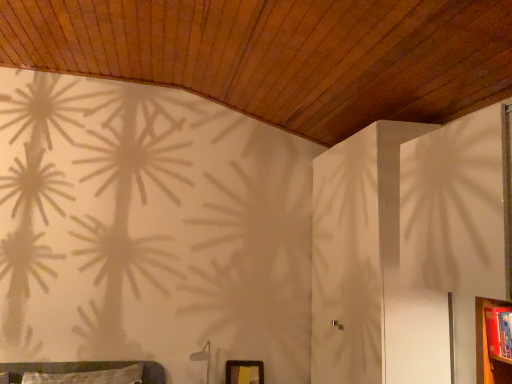
What do you see at coordinates (488, 347) in the screenshot? The width and height of the screenshot is (512, 384). I see `wooden dresser at lower right` at bounding box center [488, 347].

Find the location of `wooden dresser at lower right`. wooden dresser at lower right is located at coordinates (488, 347).

Looking at this image, what is the approximate height of wooden dresser at lower right?

9.23 inches.

Measure the distance between wooden dresser at lower right and camera.

wooden dresser at lower right and camera are 5.94 feet apart.

The height and width of the screenshot is (384, 512). Identify the location of matte black picture frame at lower center. (244, 372).

What do you see at coordinates (244, 372) in the screenshot? I see `matte black picture frame at lower center` at bounding box center [244, 372].

This screenshot has height=384, width=512. Find the location of `wooden dresser at lower right`. wooden dresser at lower right is located at coordinates (488, 347).

Considering the positions of objects wooden dresser at lower right and matte black picture frame at lower center in the image provided, who is more to the right, wooden dresser at lower right or matte black picture frame at lower center?

From the viewer's perspective, wooden dresser at lower right appears more on the right side.

Does wooden dresser at lower right come behind matte black picture frame at lower center?

No, wooden dresser at lower right is in front of matte black picture frame at lower center.

Considering the points (477, 310) and (248, 371), which point is in front, point (477, 310) or point (248, 371)?

Point (477, 310)

From the picture: From the image's perspective, is wooden dresser at lower right located above matte black picture frame at lower center?

Yes, from the image's perspective, wooden dresser at lower right is on top of matte black picture frame at lower center.

From a real-world perspective, which object rests below the other?

matte black picture frame at lower center.

Which of these two, wooden dresser at lower right or matte black picture frame at lower center, is thinner?

Thinner between the two is matte black picture frame at lower center.

Can you confirm if wooden dresser at lower right is taller than matte black picture frame at lower center?

Yes, wooden dresser at lower right is taller than matte black picture frame at lower center.

Consider the image. Does wooden dresser at lower right have a smaller size compared to matte black picture frame at lower center?

Actually, wooden dresser at lower right might be larger than matte black picture frame at lower center.

Would you say matte black picture frame at lower center is part of wooden dresser at lower right's contents?

No, matte black picture frame at lower center is located outside of wooden dresser at lower right.

Is wooden dresser at lower right placed right next to matte black picture frame at lower center?

No, wooden dresser at lower right is not touching matte black picture frame at lower center.

Is wooden dresser at lower right positioned with its back to matte black picture frame at lower center?

No, wooden dresser at lower right's orientation is not away from matte black picture frame at lower center.

Can you tell me how much wooden dresser at lower right and matte black picture frame at lower center differ in facing direction?

The angle between the facing direction of wooden dresser at lower right and the facing direction of matte black picture frame at lower center is 86.6 degrees.

Identify the location of picture frame below the wooden dresser at lower right (from a real-world perspective). This screenshot has height=384, width=512. (244, 372).

Based on the photo, between matte black picture frame at lower center and wooden dresser at lower right, which one appears on the left side from the viewer's perspective?

Positioned to the left is matte black picture frame at lower center.

Which is behind, matte black picture frame at lower center or wooden dresser at lower right?

matte black picture frame at lower center is further from the camera.

Which is farther, (243, 381) or (489, 353)?

The point (243, 381) is farther from the camera.

From the image's perspective, between matte black picture frame at lower center and wooden dresser at lower right, which one is located above?

From the image's view, wooden dresser at lower right is above.

From a real-world perspective, between matte black picture frame at lower center and wooden dresser at lower right, who is vertically higher?

From a 3D spatial view, wooden dresser at lower right is above.

Considering the sizes of objects matte black picture frame at lower center and wooden dresser at lower right in the image provided, who is thinner, matte black picture frame at lower center or wooden dresser at lower right?

With smaller width is matte black picture frame at lower center.

Considering the relative sizes of matte black picture frame at lower center and wooden dresser at lower right in the image provided, is matte black picture frame at lower center taller than wooden dresser at lower right?

No, matte black picture frame at lower center is not taller than wooden dresser at lower right.

Considering the relative sizes of matte black picture frame at lower center and wooden dresser at lower right in the image provided, is matte black picture frame at lower center smaller than wooden dresser at lower right?

Indeed, matte black picture frame at lower center has a smaller size compared to wooden dresser at lower right.

Would you say matte black picture frame at lower center is outside wooden dresser at lower right?

matte black picture frame at lower center is positioned outside wooden dresser at lower right.

Would you say matte black picture frame at lower center is a long distance from wooden dresser at lower right?

matte black picture frame at lower center is positioned a significant distance from wooden dresser at lower right.

Based on the photo, is matte black picture frame at lower center looking in the opposite direction of wooden dresser at lower right?

No, matte black picture frame at lower center is not facing the opposite direction of wooden dresser at lower right.

In the scene shown: What's the angular difference between matte black picture frame at lower center and wooden dresser at lower right's facing directions?

matte black picture frame at lower center and wooden dresser at lower right are facing 86.6 degrees away from each other.

Where is `picture frame that is behind the wooden dresser at lower right`? The height and width of the screenshot is (384, 512). picture frame that is behind the wooden dresser at lower right is located at coordinates (244, 372).

This screenshot has height=384, width=512. Find the location of `picture frame behind the wooden dresser at lower right`. picture frame behind the wooden dresser at lower right is located at coordinates (244, 372).

The image size is (512, 384). Identify the location of dresser in front of the matte black picture frame at lower center. (488, 347).